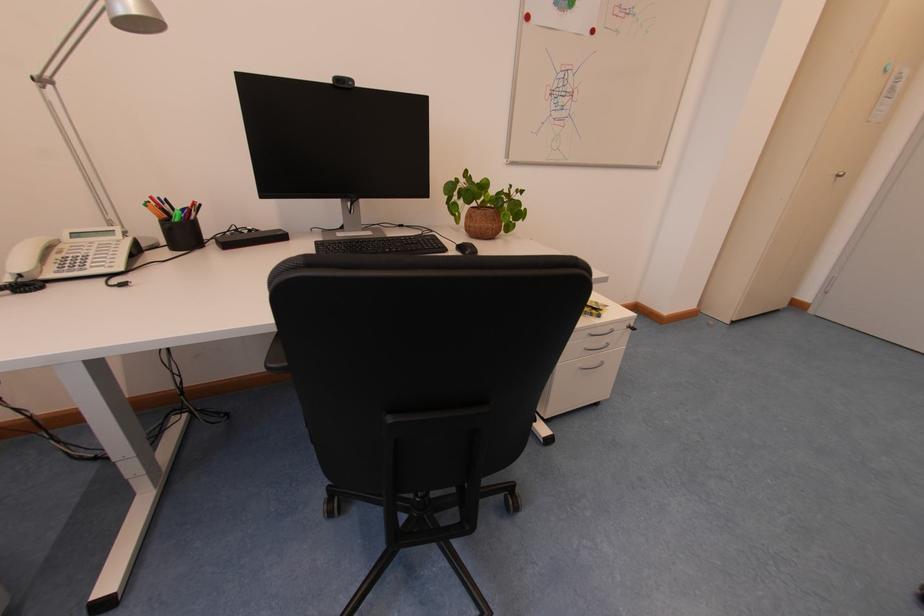
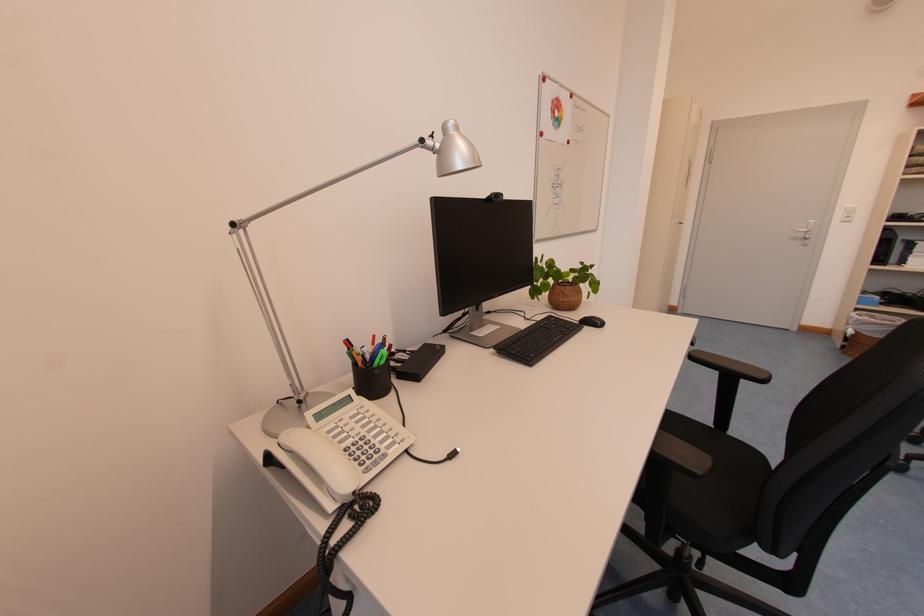
Question: In a continuous first-person perspective shot, in which direction is the camera moving?

Choices:
 (A) Left
 (B) Right
 (C) Forward
 (D) Backward

Answer: (A)